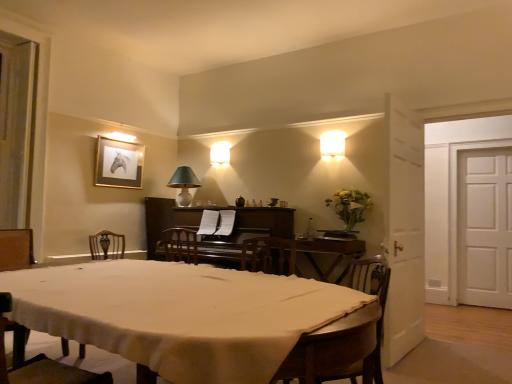
Find the location of a particular element. The height and width of the screenshot is (384, 512). free space above matte white lampshade at upper right, arranged as the 1th lamp when viewed from the right (from a real-world perspective) is located at coordinates (330, 141).